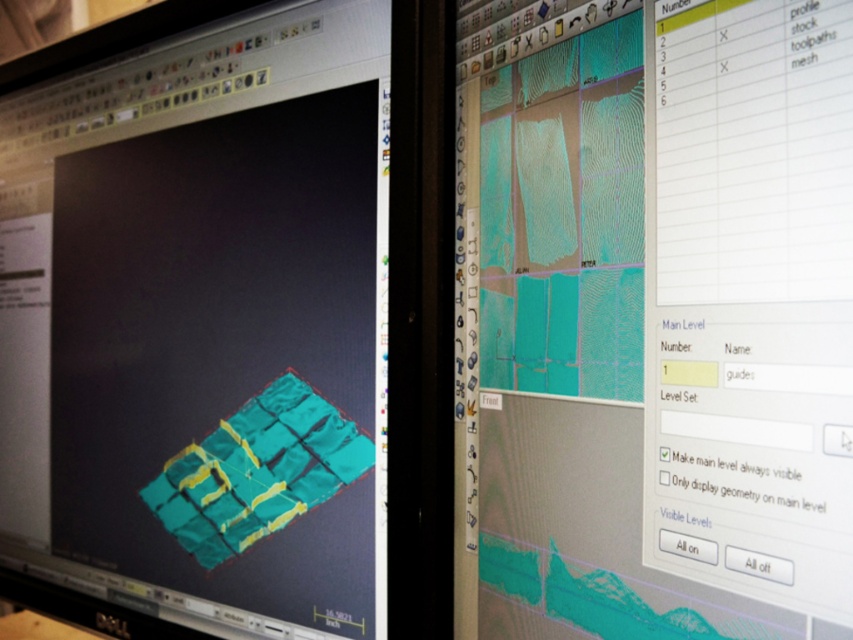
Question: Is teal matte cube at center further to camera compared to teal matte mesh at center?

Choices:
 (A) yes
 (B) no

Answer: (A)

Question: Is teal matte cube at center bigger than teal matte mesh at center?

Choices:
 (A) yes
 (B) no

Answer: (A)

Question: Which of the following is the farthest from the observer?

Choices:
 (A) teal matte mesh at center
 (B) teal matte cube at center

Answer: (B)

Question: Which object is farther from the camera taking this photo?

Choices:
 (A) teal matte cube at center
 (B) teal matte mesh at center

Answer: (A)

Question: Which of the following is the farthest from the observer?

Choices:
 (A) (497, 545)
 (B) (263, 573)

Answer: (B)

Question: Can you confirm if teal matte cube at center is wider than teal matte mesh at center?

Choices:
 (A) yes
 (B) no

Answer: (A)